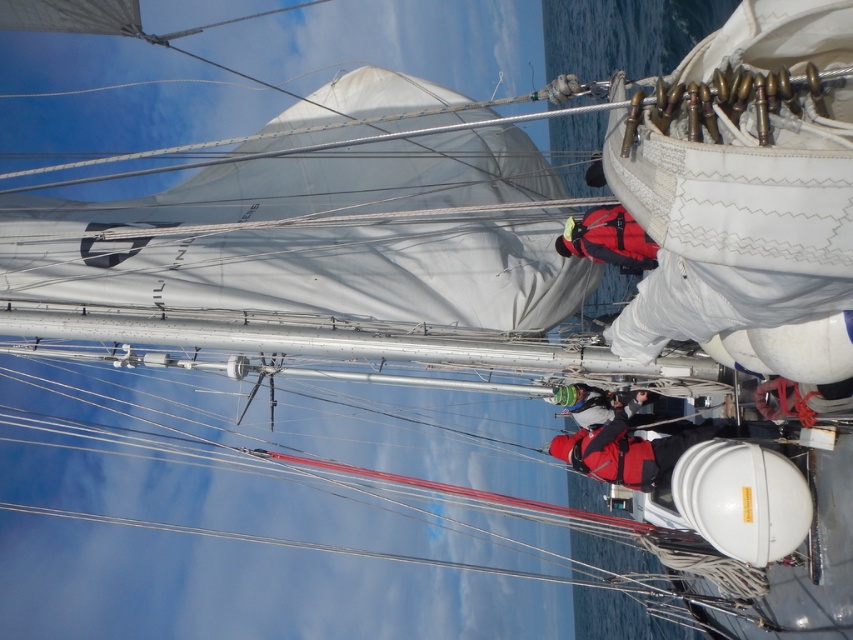
Question: Does red fabric jacket at center have a greater width compared to green knitted hat at center?

Choices:
 (A) no
 (B) yes

Answer: (B)

Question: Does red fabric jacket at center lie behind green knitted hat at center?

Choices:
 (A) yes
 (B) no

Answer: (B)

Question: Among these points, which one is nearest to the camera?

Choices:
 (A) (618, 474)
 (B) (590, 410)

Answer: (A)

Question: Is red fabric jacket at center to the right of green knitted hat at center from the viewer's perspective?

Choices:
 (A) no
 (B) yes

Answer: (B)

Question: Which object is farther from the camera taking this photo?

Choices:
 (A) red fabric jacket at center
 (B) green knitted hat at center

Answer: (B)